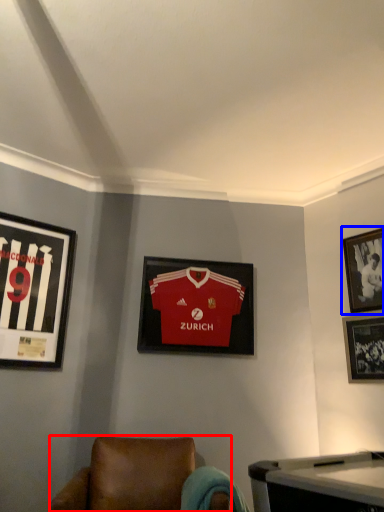
Question: Which object is closer to the camera taking this photo, chair (highlighted by a red box) or picture frame (highlighted by a blue box)?

Choices:
 (A) chair
 (B) picture frame

Answer: (A)